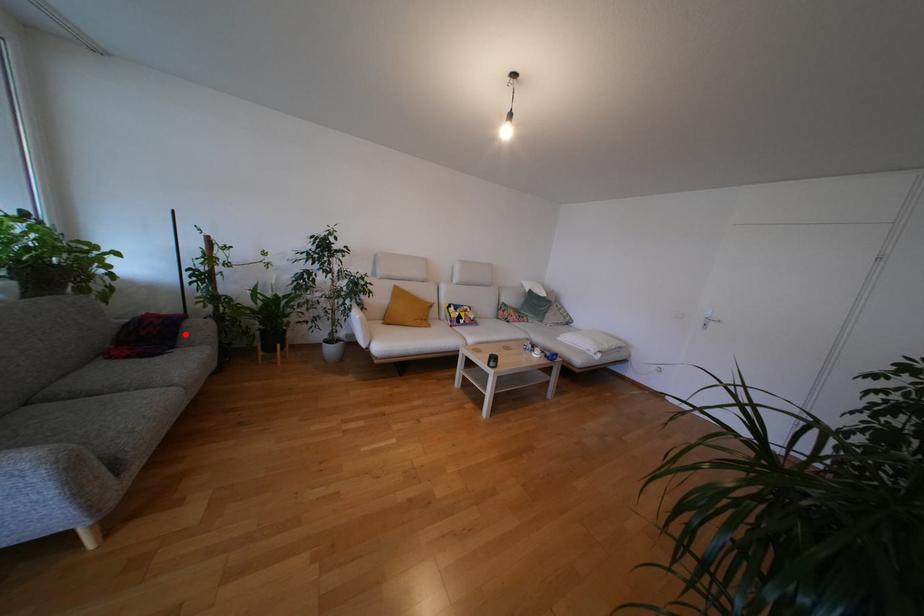
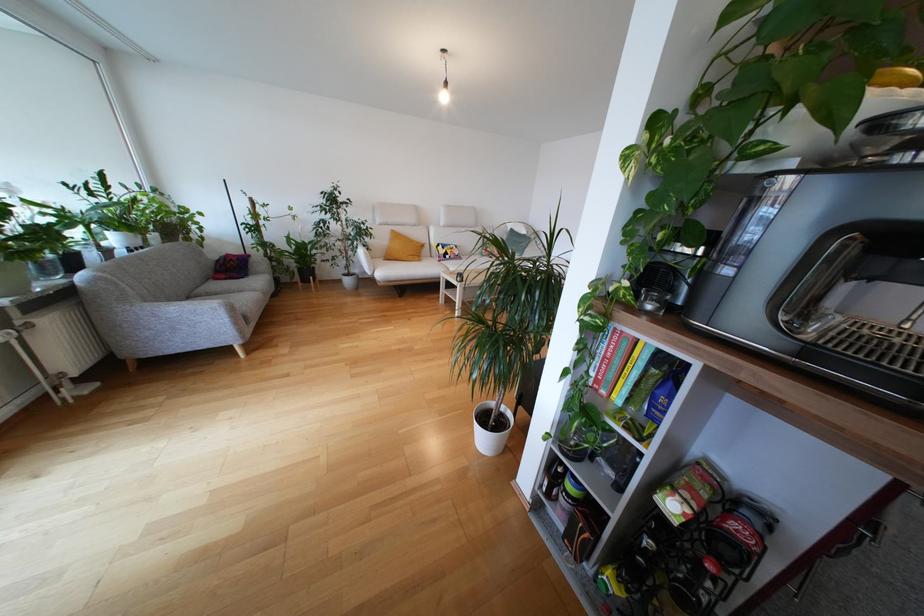
Question: I am providing you with two images of the same scene from different viewpoints. In image1, a red point is highlighted. Considering the same 3D point in image2, which of the following is correct?

Choices:
 (A) It is closer
 (B) It is farther

Answer: (A)